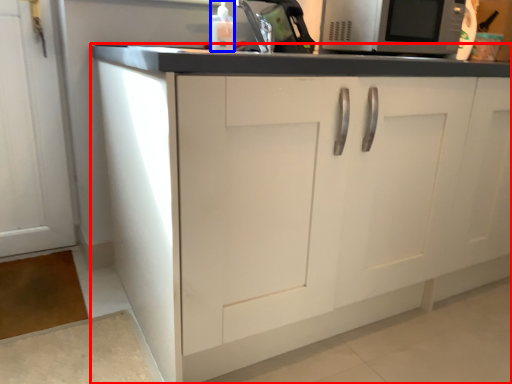
Question: Which of the following is the closest to the observer, cabinetry (highlighted by a red box) or bottle (highlighted by a blue box)?

Choices:
 (A) cabinetry
 (B) bottle

Answer: (A)